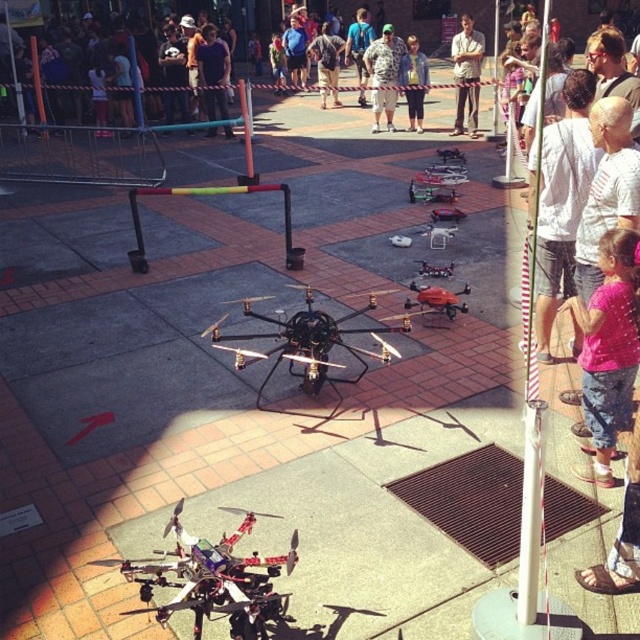
Consider the image. You are a photographer at the event and want to capture a clear photo of the polished metallic drone at lower center without any obstructions. However, the denim jacket at center is blocking part of the drone. Based on their positions, can you adjust your angle to take the photo without moving any objects?

The polished metallic drone at lower center is in front of the denim jacket at center, so you can take the photo from an angle where the drone is visible without the jacket obstructing it by positioning yourself in front of the drone where the jacket is behind it.

You are a participant in the drone event and need to place a 3.35 feet long banner between the two drones. Is there enough space between the polished metallic drone at lower center and the other drone to fit the banner?

The two drones are 9.14 feet apart, and the banner is 3.35 feet long. Since 9.14 feet is greater than 3.35 feet, there is sufficient space to place the banner between the polished metallic drone at lower center and the other drone.